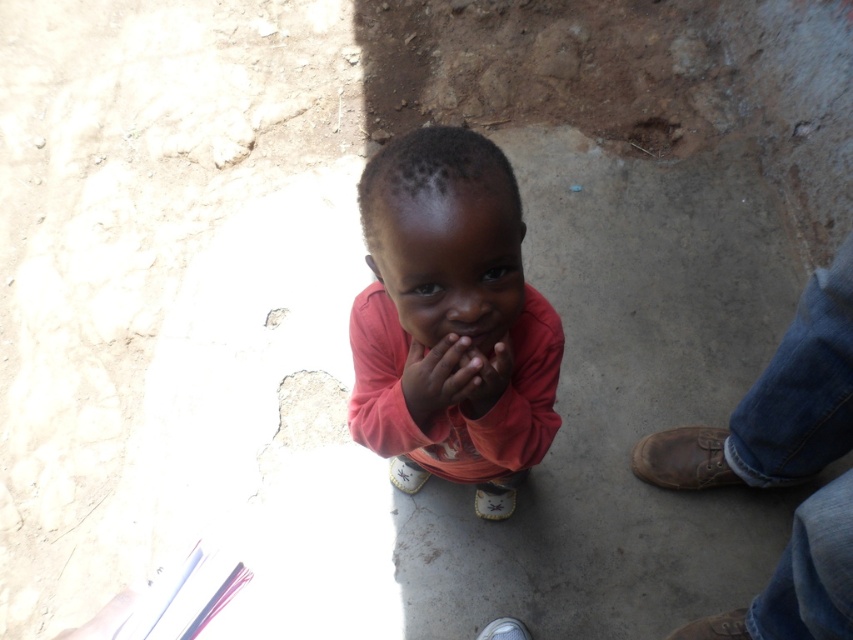
Which is more to the right, smooth skin hand at center or white paper at center?

smooth skin hand at center

Locate an element on the screen. smooth skin hand at center is located at coordinates (486, 378).

Based on the photo, between matte pink shirt at center and smooth skin hand at center, which one appears on the right side from the viewer's perspective?

From the viewer's perspective, smooth skin hand at center appears more on the right side.

Describe the element at coordinates (448, 317) in the screenshot. I see `matte pink shirt at center` at that location.

Identify the location of matte pink shirt at center. Image resolution: width=853 pixels, height=640 pixels. (448, 317).

Which is more to the right, matte skin hand at center or smooth skin hand at center?

Positioned to the right is smooth skin hand at center.

Does point (469, 381) lie behind point (502, 337)?

That is False.

Identify the location of matte skin hand at center. Image resolution: width=853 pixels, height=640 pixels. (439, 376).